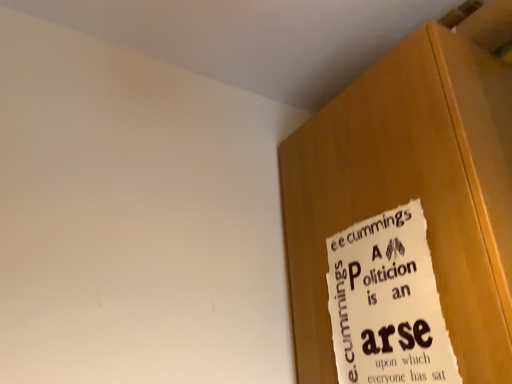
This screenshot has height=384, width=512. What do you see at coordinates (387, 303) in the screenshot?
I see `white paper at upper right` at bounding box center [387, 303].

Locate an element on the screen. white paper at upper right is located at coordinates (387, 303).

Identify the location of white paper at upper right. The height and width of the screenshot is (384, 512). (387, 303).